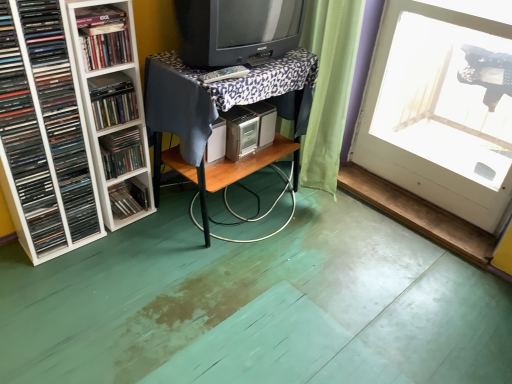
The width and height of the screenshot is (512, 384). What are the coordinates of `vacant space to the right of wooden table at center, positioned as the second table in top-to-bottom order` in the screenshot? It's located at tap(371, 242).